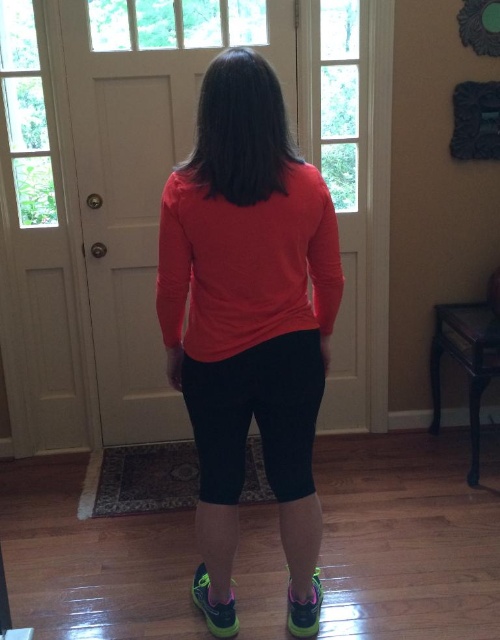
You are standing in a room and want to reach a specific point marked at coordinates point (298,465). If you can move forward 1.7 meters, will you be able to reach that point?

The distance of point (298,465) from viewer is 1.72 meters. Moving forward 1.7 meters will not be enough to reach the point, as you need an additional 0.02 meters.